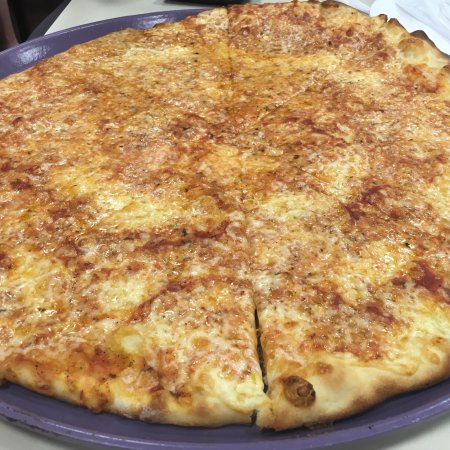
Where is `purple round platter`? The height and width of the screenshot is (450, 450). purple round platter is located at coordinates (378, 426).